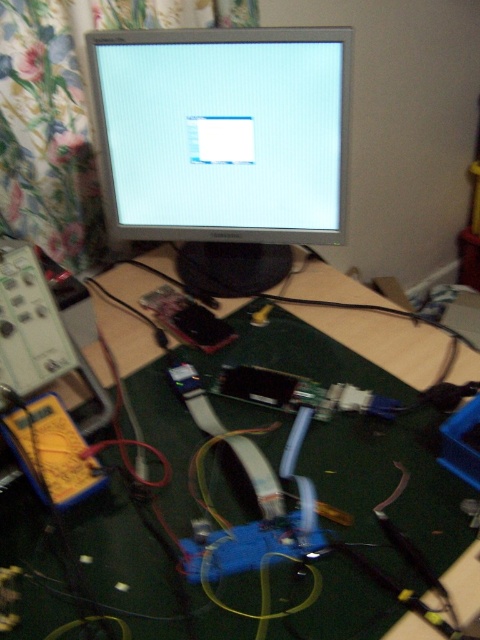
Question: Can you confirm if silver metallic monitor at center is wider than green fabric table at center?

Choices:
 (A) yes
 (B) no

Answer: (B)

Question: Which of the following is the closest to the observer?

Choices:
 (A) (154, 49)
 (B) (105, 406)

Answer: (B)

Question: Which of the following is the farthest from the observer?

Choices:
 (A) (252, 269)
 (B) (465, 358)

Answer: (A)

Question: Does silver metallic monitor at center come behind green fabric table at center?

Choices:
 (A) no
 (B) yes

Answer: (B)

Question: Does silver metallic monitor at center appear under green fabric table at center?

Choices:
 (A) yes
 (B) no

Answer: (B)